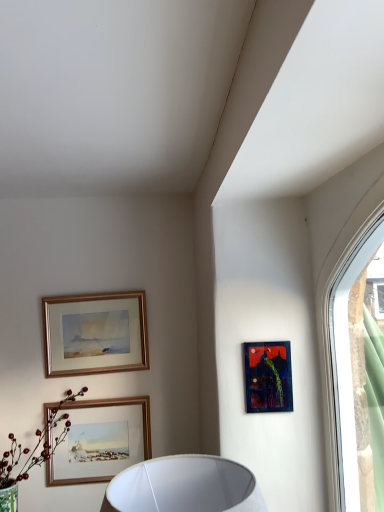
Locate an element on the screen. The width and height of the screenshot is (384, 512). wooden-framed painting at upper left, placed as the first picture frame when sorted from top to bottom is located at coordinates (95, 333).

Measure the distance between point (100, 477) and camera.

They are 1.86 meters apart.

The image size is (384, 512). What do you see at coordinates (268, 377) in the screenshot?
I see `dark blue textured painting at upper right, which ranks as the 3th picture frame in back-to-front order` at bounding box center [268, 377].

Measure the distance between clear glass window at upper right and camera.

3.30 feet.

The height and width of the screenshot is (512, 384). Identify the location of wooden-framed painting at upper left, placed as the 3th picture frame when sorted from front to back. (95, 333).

Which object is wider, green matte flower at lower left or wooden framed picture at lower center, which ranks as the second picture frame in back-to-front order?

green matte flower at lower left is wider.

Who is smaller, green matte flower at lower left or wooden framed picture at lower center, the second picture frame in the right-to-left sequence?

With smaller size is wooden framed picture at lower center, the second picture frame in the right-to-left sequence.

Is green matte flower at lower left looking in the opposite direction of wooden framed picture at lower center, which ranks as the second picture frame in back-to-front order?

No, wooden framed picture at lower center, which ranks as the second picture frame in back-to-front order, is not at the back of green matte flower at lower left.

In the scene shown: From the image's perspective, which one is positioned higher, wooden-framed painting at upper left, acting as the third picture frame starting from the right, or dark blue textured painting at upper right, which is counted as the second picture frame, starting from the top?

From the image's view, wooden-framed painting at upper left, acting as the third picture frame starting from the right, is above.

From a real-world perspective, is wooden-framed painting at upper left, placed as the 3th picture frame when sorted from front to back, positioned above or below dark blue textured painting at upper right, which is counted as the 3th picture frame, starting from the left?

wooden-framed painting at upper left, placed as the 3th picture frame when sorted from front to back, is above dark blue textured painting at upper right, which is counted as the 3th picture frame, starting from the left.

Considering the relative sizes of wooden-framed painting at upper left, acting as the third picture frame starting from the right, and dark blue textured painting at upper right, which is counted as the 3th picture frame, starting from the left, in the image provided, is wooden-framed painting at upper left, acting as the third picture frame starting from the right, bigger than dark blue textured painting at upper right, which is counted as the 3th picture frame, starting from the left,?

Correct, wooden-framed painting at upper left, acting as the third picture frame starting from the right, is larger in size than dark blue textured painting at upper right, which is counted as the 3th picture frame, starting from the left.

Starting from the dark blue textured painting at upper right, placed as the 1th picture frame when sorted from front to back, which picture frame is the 2nd one behind? Please provide its 2D coordinates.

[(95, 333)]

Considering the relative sizes of clear glass window at upper right and wooden-framed painting at upper left, placed as the 3th picture frame when sorted from front to back, in the image provided, is clear glass window at upper right smaller than wooden-framed painting at upper left, placed as the 3th picture frame when sorted from front to back,?

Actually, clear glass window at upper right might be larger than wooden-framed painting at upper left, placed as the 3th picture frame when sorted from front to back.

Which object is further away from the camera taking this photo, clear glass window at upper right or wooden-framed painting at upper left, acting as the third picture frame starting from the right?

wooden-framed painting at upper left, acting as the third picture frame starting from the right, is further from the camera.

Locate an element on the screen. The image size is (384, 512). window in front of the wooden-framed painting at upper left, which appears as the first picture frame when viewed from the left is located at coordinates (345, 361).

Is clear glass window at upper right smaller than wooden framed picture at lower center, arranged as the second picture frame when viewed from the front?

No.

Is clear glass window at upper right aimed at wooden framed picture at lower center, which is counted as the 3th picture frame, starting from the top?

No, clear glass window at upper right is not aimed at wooden framed picture at lower center, which is counted as the 3th picture frame, starting from the top.

Is clear glass window at upper right with wooden framed picture at lower center, which is counted as the 3th picture frame, starting from the top?

No, clear glass window at upper right is not with wooden framed picture at lower center, which is counted as the 3th picture frame, starting from the top.

Considering the relative positions of clear glass window at upper right and wooden framed picture at lower center, which ranks as the second picture frame in back-to-front order, in the image provided, is clear glass window at upper right to the right of wooden framed picture at lower center, which ranks as the second picture frame in back-to-front order, from the viewer's perspective?

Correct, you'll find clear glass window at upper right to the right of wooden framed picture at lower center, which ranks as the second picture frame in back-to-front order.

Between dark blue textured painting at upper right, placed as the 1th picture frame when sorted from front to back, and clear glass window at upper right, which one has smaller size?

With smaller size is dark blue textured painting at upper right, placed as the 1th picture frame when sorted from front to back.

Is the position of dark blue textured painting at upper right, placed as the 1th picture frame when sorted from front to back, less distant than that of clear glass window at upper right?

No, the depth of dark blue textured painting at upper right, placed as the 1th picture frame when sorted from front to back, is greater than that of clear glass window at upper right.

In terms of height, does dark blue textured painting at upper right, acting as the 1th picture frame starting from the right, look taller or shorter compared to clear glass window at upper right?

Clearly, dark blue textured painting at upper right, acting as the 1th picture frame starting from the right, is shorter compared to clear glass window at upper right.

Based on the photo, which object is positioned more to the right, dark blue textured painting at upper right, which ranks as the 3th picture frame in back-to-front order, or clear glass window at upper right?

clear glass window at upper right.

Is green matte flower at lower left completely or partially outside of dark blue textured painting at upper right, acting as the 1th picture frame starting from the right?

green matte flower at lower left lies outside dark blue textured painting at upper right, acting as the 1th picture frame starting from the right,'s area.

From the image's perspective, which object appears higher, green matte flower at lower left or dark blue textured painting at upper right, placed as the 1th picture frame when sorted from front to back?

dark blue textured painting at upper right, placed as the 1th picture frame when sorted from front to back.

The image size is (384, 512). Find the location of `flower below the dark blue textured painting at upper right, which is counted as the 3th picture frame, starting from the left (from a real-world perspective)`. flower below the dark blue textured painting at upper right, which is counted as the 3th picture frame, starting from the left (from a real-world perspective) is located at coordinates (35, 446).

How different are the orientations of green matte flower at lower left and dark blue textured painting at upper right, acting as the 1th picture frame starting from the right, in degrees?

The angular difference between green matte flower at lower left and dark blue textured painting at upper right, acting as the 1th picture frame starting from the right, is 2.83 degrees.

Are clear glass window at upper right and green matte flower at lower left beside each other?

No.

From a real-world perspective, which is physically above, clear glass window at upper right or green matte flower at lower left?

clear glass window at upper right is physically above.

Who is bigger, clear glass window at upper right or green matte flower at lower left?

With larger size is green matte flower at lower left.

At what (x,y) coordinates should I click in order to perform the action: click on flower to the left of wooden framed picture at lower center, which is counted as the 3th picture frame, starting from the top. Please return your answer as a coordinate pair (x, y). Looking at the image, I should click on (35, 446).

From the wooden-framed painting at upper left, which appears as the 1th picture frame when viewed from the back, count 2nd picture frame to the right and point to it. Please provide its 2D coordinates.

[(268, 377)]

Looking at the image, which one is located further to dark blue textured painting at upper right, which is counted as the second picture frame, starting from the top, green matte flower at lower left or wooden framed picture at lower center, arranged as the second picture frame when viewed from the front?

green matte flower at lower left is positioned further to the anchor dark blue textured painting at upper right, which is counted as the second picture frame, starting from the top.

When comparing their distances from wooden-framed painting at upper left, which appears as the first picture frame when viewed from the left, does green matte flower at lower left or wooden framed picture at lower center, arranged as the first picture frame when ordered from the bottom, seem closer?

The object closer to wooden-framed painting at upper left, which appears as the first picture frame when viewed from the left, is green matte flower at lower left.

Which object lies further to the anchor point clear glass window at upper right, dark blue textured painting at upper right, placed as the 1th picture frame when sorted from front to back, or green matte flower at lower left?

Among the two, green matte flower at lower left is located further to clear glass window at upper right.

From the image, which object appears to be farther from wooden framed picture at lower center, which ranks as the second picture frame in back-to-front order, clear glass window at upper right or green matte flower at lower left?

clear glass window at upper right.

Which object lies further to the anchor point dark blue textured painting at upper right, which is counted as the 3th picture frame, starting from the left, wooden framed picture at lower center, acting as the 2th picture frame starting from the left, or clear glass window at upper right?

The object further to dark blue textured painting at upper right, which is counted as the 3th picture frame, starting from the left, is wooden framed picture at lower center, acting as the 2th picture frame starting from the left.

Looking at the image, which one is located closer to wooden framed picture at lower center, which ranks as the second picture frame in back-to-front order, wooden-framed painting at upper left, acting as the third picture frame starting from the right, or clear glass window at upper right?

wooden-framed painting at upper left, acting as the third picture frame starting from the right.

Based on their spatial positions, is wooden framed picture at lower center, which ranks as the second picture frame in back-to-front order, or wooden-framed painting at upper left, which appears as the first picture frame when viewed from the left, closer to clear glass window at upper right?

Based on the image, wooden framed picture at lower center, which ranks as the second picture frame in back-to-front order, appears to be nearer to clear glass window at upper right.

When comparing their distances from clear glass window at upper right, does wooden-framed painting at upper left, acting as the third picture frame starting from the right, or wooden framed picture at lower center, the second picture frame in the right-to-left sequence, seem further?

Based on the image, wooden-framed painting at upper left, acting as the third picture frame starting from the right, appears to be further to clear glass window at upper right.

Identify the location of picture frame between clear glass window at upper right and wooden framed picture at lower center, which ranks as the second picture frame in back-to-front order, along the z-axis. The image size is (384, 512). coord(268,377).

Where is `picture frame situated between wooden-framed painting at upper left, acting as the third picture frame starting from the right, and dark blue textured painting at upper right, which is counted as the second picture frame, starting from the top, from left to right`? The width and height of the screenshot is (384, 512). picture frame situated between wooden-framed painting at upper left, acting as the third picture frame starting from the right, and dark blue textured painting at upper right, which is counted as the second picture frame, starting from the top, from left to right is located at coordinates (102, 440).